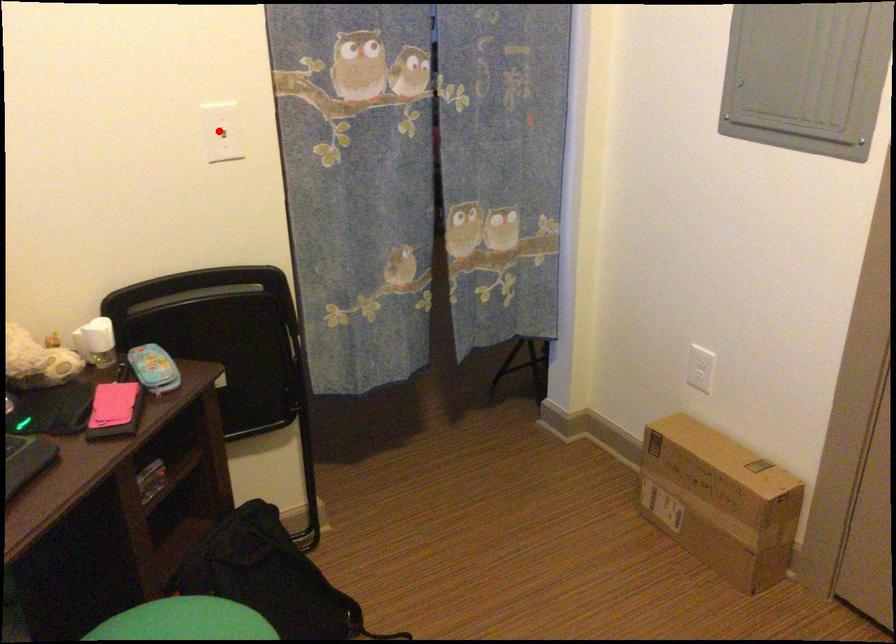
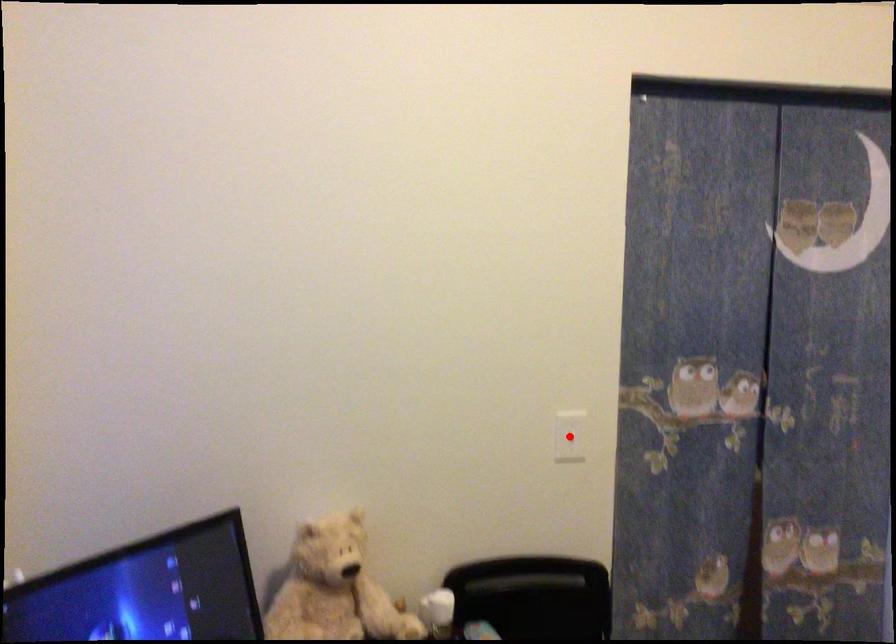
I am providing you with two images of the same scene from different viewpoints. A red point is marked on the first image and another point is marked on the second image. Are the points marked in image1 and image2 representing the same 3D position?

Yes